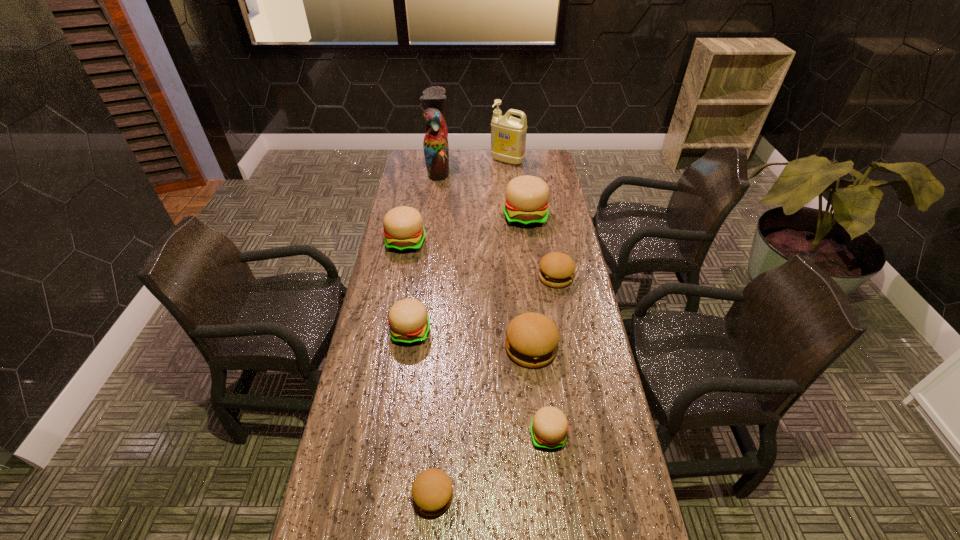
In order to click on vacant space that satisfies the following two spatial constraints: 1. at the face of the nearest beige hamburger; 2. on the right side of the tallest object in this screenshot , I will do `click(403, 435)`.

Image resolution: width=960 pixels, height=540 pixels. I want to click on free point that satisfies the following two spatial constraints: 1. at the face of the second farthest brown hamburger; 2. on the right side of the tallest object, so click(415, 348).